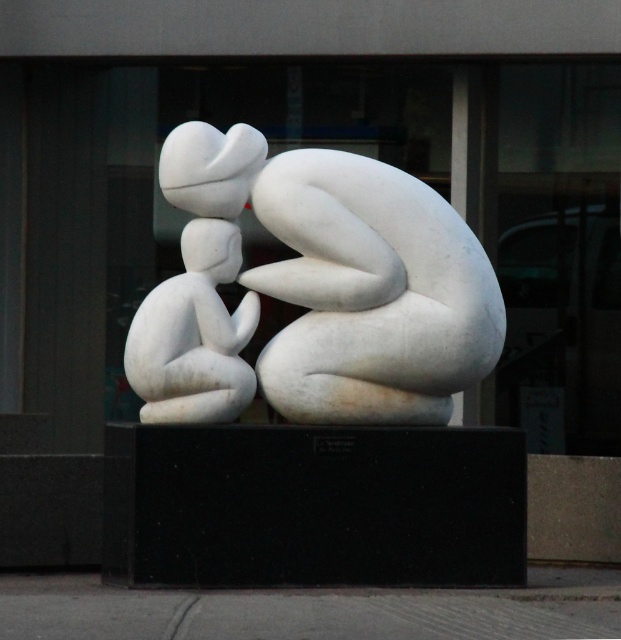
Is white marble sculpture at center above white matte stone child at left?

Yes.

In order to click on white marble sculpture at center in this screenshot , I will do `click(343, 276)`.

This screenshot has width=621, height=640. Find the location of `white marble sculpture at center`. white marble sculpture at center is located at coordinates (343, 276).